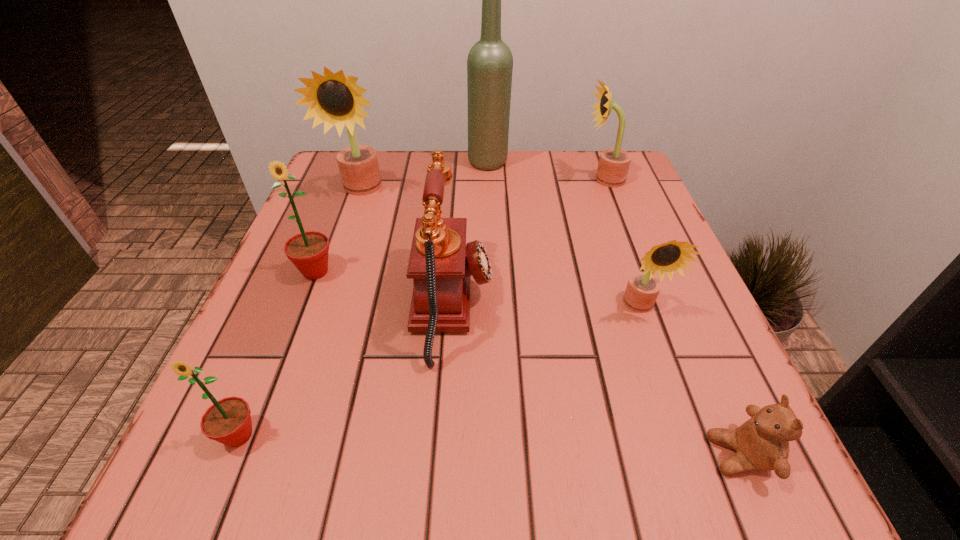
Where is `the nearest sunflower`? The height and width of the screenshot is (540, 960). the nearest sunflower is located at coordinates (228, 421).

The width and height of the screenshot is (960, 540). I want to click on the nearer green sunflower, so click(228, 421).

The image size is (960, 540). In order to click on brown teddy bear in this screenshot , I will do `click(761, 443)`.

Locate an element on the screen. This screenshot has width=960, height=540. teddy bear is located at coordinates (761, 443).

In order to click on free space located 0.120m on the front of the wine bottle in this screenshot , I will do `click(490, 201)`.

You are a GUI agent. You are given a task and a screenshot of the screen. Output one action in this format:
    pyautogui.click(x=<x>, y=<y>)
    Task: Click on the free spot located 0.250m on the face of the tallest sunflower
    The image size is (960, 540).
    Given the screenshot: What is the action you would take?
    pyautogui.click(x=328, y=284)

Identify the location of vacant space located on the face of the second biggest yellow sunflower. The image size is (960, 540). pyautogui.click(x=541, y=180).

Where is `vacant space positioned 0.370m on the face of the second biggest yellow sunflower`? The image size is (960, 540). vacant space positioned 0.370m on the face of the second biggest yellow sunflower is located at coordinates (430, 180).

Where is `blank area located on the face of the second biggest yellow sunflower`? This screenshot has width=960, height=540. blank area located on the face of the second biggest yellow sunflower is located at coordinates (554, 180).

This screenshot has width=960, height=540. In order to click on free point located on the face of the farther green sunflower in this screenshot , I will do `click(277, 369)`.